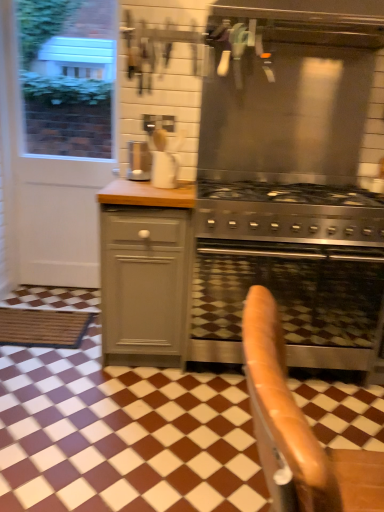
Question: Considering the relative sizes of stainless steel vent at upper center and stainless steel oven at center in the image provided, is stainless steel vent at upper center taller than stainless steel oven at center?

Choices:
 (A) yes
 (B) no

Answer: (A)

Question: Is stainless steel vent at upper center surrounding stainless steel oven at center?

Choices:
 (A) yes
 (B) no

Answer: (B)

Question: Can you confirm if stainless steel vent at upper center is wider than stainless steel oven at center?

Choices:
 (A) yes
 (B) no

Answer: (A)

Question: From a real-world perspective, is stainless steel vent at upper center located beneath stainless steel oven at center?

Choices:
 (A) no
 (B) yes

Answer: (A)

Question: Is stainless steel vent at upper center facing towards stainless steel oven at center?

Choices:
 (A) yes
 (B) no

Answer: (B)

Question: Based on their sizes in the image, would you say stainless steel oven at center is bigger or smaller than satin silver coffee machine at center?

Choices:
 (A) small
 (B) big

Answer: (B)

Question: From the image's perspective, is stainless steel oven at center above or below satin silver coffee machine at center?

Choices:
 (A) below
 (B) above

Answer: (A)

Question: Would you say stainless steel oven at center is to the left or to the right of satin silver coffee machine at center in the picture?

Choices:
 (A) right
 (B) left

Answer: (A)

Question: Is stainless steel oven at center taller or shorter than satin silver coffee machine at center?

Choices:
 (A) tall
 (B) short

Answer: (A)

Question: Considering the relative positions of matte gray cabinet at center-left and satin silver coffee machine at center in the image provided, is matte gray cabinet at center-left to the left or to the right of satin silver coffee machine at center?

Choices:
 (A) right
 (B) left

Answer: (A)

Question: Would you say matte gray cabinet at center-left is inside or outside satin silver coffee machine at center?

Choices:
 (A) outside
 (B) inside

Answer: (A)

Question: From the image's perspective, is matte gray cabinet at center-left located above or below satin silver coffee machine at center?

Choices:
 (A) above
 (B) below

Answer: (B)

Question: Looking at their shapes, would you say matte gray cabinet at center-left is wider or thinner than satin silver coffee machine at center?

Choices:
 (A) thin
 (B) wide

Answer: (B)

Question: Does point (322, 362) appear closer or farther from the camera than point (64, 46)?

Choices:
 (A) closer
 (B) farther

Answer: (A)

Question: Considering the relative positions of stainless steel oven at center and white matte screen door at left in the image provided, is stainless steel oven at center to the left or to the right of white matte screen door at left?

Choices:
 (A) right
 (B) left

Answer: (A)